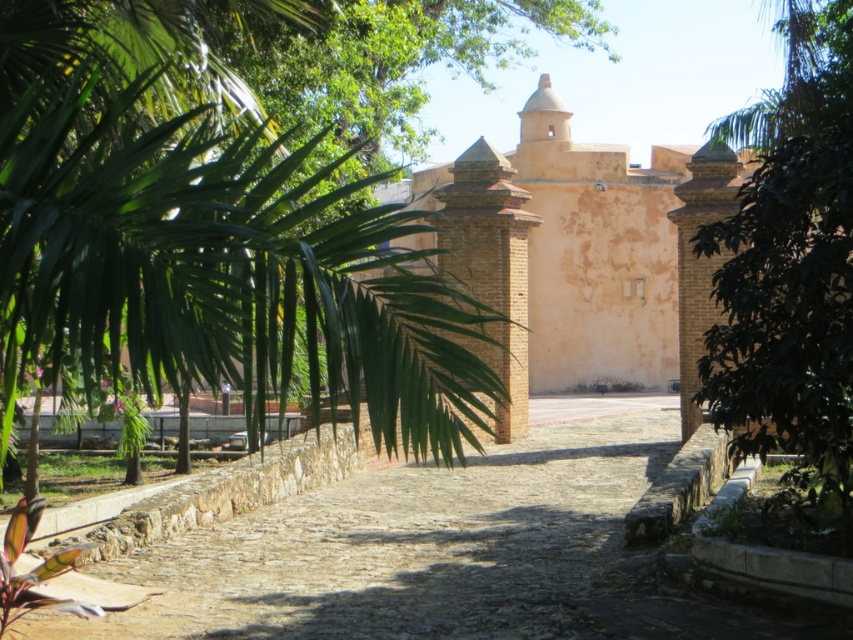
Question: Does brown cobblestone path at center have a smaller size compared to light brown brick church at center?

Choices:
 (A) yes
 (B) no

Answer: (A)

Question: Is brown cobblestone path at center wider than light brown brick church at center?

Choices:
 (A) yes
 (B) no

Answer: (B)

Question: Which point appears closest to the camera in this image?

Choices:
 (A) (724, 268)
 (B) (604, 369)
 (C) (590, 552)

Answer: (A)

Question: Among these objects, which one is farthest from the camera?

Choices:
 (A) green leafy tree at center
 (B) light brown brick church at center
 (C) brown cobblestone path at center

Answer: (B)

Question: Which object appears closest to the camera in this image?

Choices:
 (A) light brown brick church at center
 (B) green leafy tree at center

Answer: (B)

Question: Does brown cobblestone path at center lie behind green leafy tree at center?

Choices:
 (A) no
 (B) yes

Answer: (B)